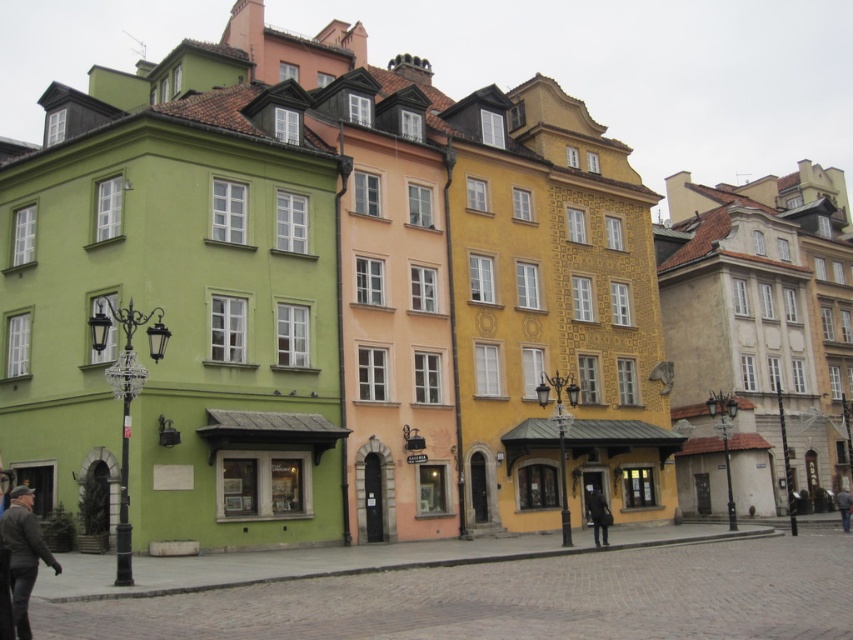
Question: Can you confirm if dark gray leather jacket at lower left is positioned above dark gray fabric coat at center?

Choices:
 (A) no
 (B) yes

Answer: (B)

Question: Which object appears closest to the camera in this image?

Choices:
 (A) dark gray fabric coat at center
 (B) dark gray fabric jacket at lower right
 (C) dark gray leather jacket at lower left

Answer: (C)

Question: Which object appears farthest from the camera in this image?

Choices:
 (A) dark gray leather jacket at lower left
 (B) dark gray fabric coat at center

Answer: (B)

Question: Does dark gray leather jacket at lower left have a larger size compared to dark gray fabric coat at center?

Choices:
 (A) yes
 (B) no

Answer: (A)

Question: Can you confirm if dark gray fabric coat at center is positioned to the left of dark gray fabric jacket at lower right?

Choices:
 (A) no
 (B) yes

Answer: (B)

Question: Among these objects, which one is farthest from the camera?

Choices:
 (A) dark gray leather jacket at lower left
 (B) dark gray fabric coat at center
 (C) dark gray fabric jacket at lower right

Answer: (C)